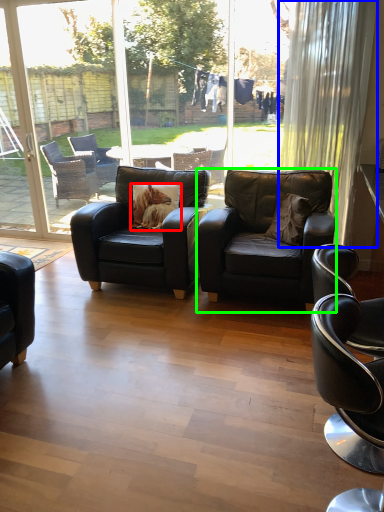
Question: Based on their relative distances, which object is farther from pillow (highlighted by a red box)? Choose from curtain (highlighted by a blue box) and chair (highlighted by a green box).

Choices:
 (A) curtain
 (B) chair

Answer: (A)